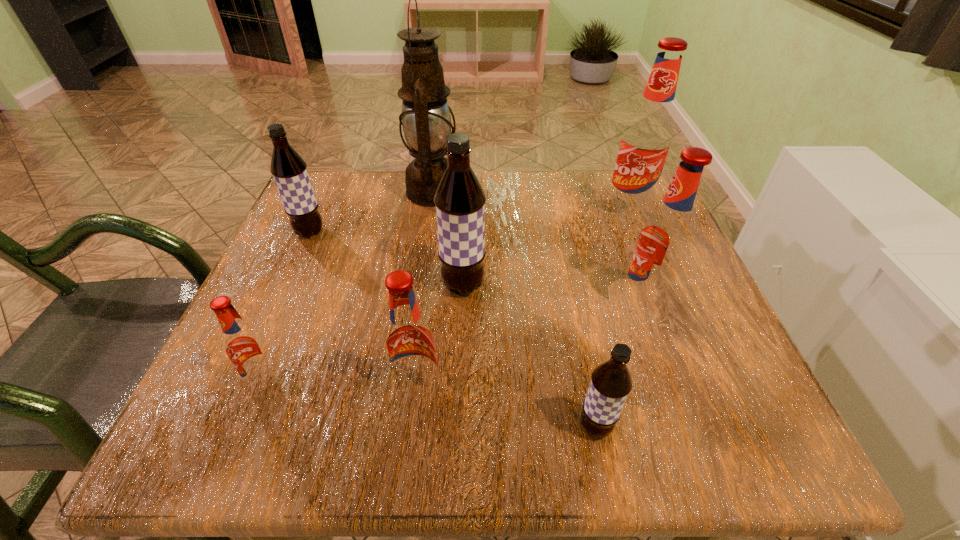
Select which root beer appears as the fourth closest to the second farthest red root beer. Please provide its 2D coordinates. Your answer should be formatted as a tuple, i.e. [(x, y)], where the tuple contains the x and y coordinates of a point satisfying the conditions above.

[(409, 343)]

The image size is (960, 540). I want to click on the second closest red root beer to the oil lamp, so click(x=666, y=240).

This screenshot has width=960, height=540. What are the coordinates of `the third closest red root beer to the second smallest brown root beer` in the screenshot? It's located at (666, 240).

I want to click on brown root beer that stands as the second closest to the second farthest red root beer, so click(x=459, y=200).

Identify which brown root beer is the nearest to the second smallest brown root beer. Please provide its 2D coordinates. Your answer should be formatted as a tuple, i.e. [(x, y)], where the tuple contains the x and y coordinates of a point satisfying the conditions above.

[(459, 200)]

This screenshot has width=960, height=540. In order to click on free space that satisfies the following two spatial constraints: 1. on the back side of the farthest red root beer; 2. on the right side of the third biggest red root beer in this screenshot , I will do `click(439, 210)`.

This screenshot has width=960, height=540. I want to click on vacant space that satisfies the following two spatial constraints: 1. on the back side of the biggest red root beer; 2. on the right side of the second farthest red root beer, so click(x=611, y=210).

Locate an element on the screen. vacant point that satisfies the following two spatial constraints: 1. on the back side of the tallest root beer; 2. on the right side of the second smallest brown root beer is located at coordinates (320, 210).

Find the location of `blank area in the image that satisfies the following two spatial constraints: 1. on the back side of the brown oil lamp; 2. on the left side of the second smallest brown root beer`. blank area in the image that satisfies the following two spatial constraints: 1. on the back side of the brown oil lamp; 2. on the left side of the second smallest brown root beer is located at coordinates (328, 192).